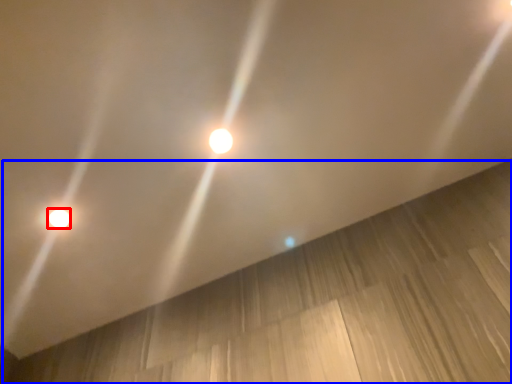
Question: Which point is further to the camera, lamp (highlighted by a red box) or plywood (highlighted by a blue box)?

Choices:
 (A) lamp
 (B) plywood

Answer: (A)